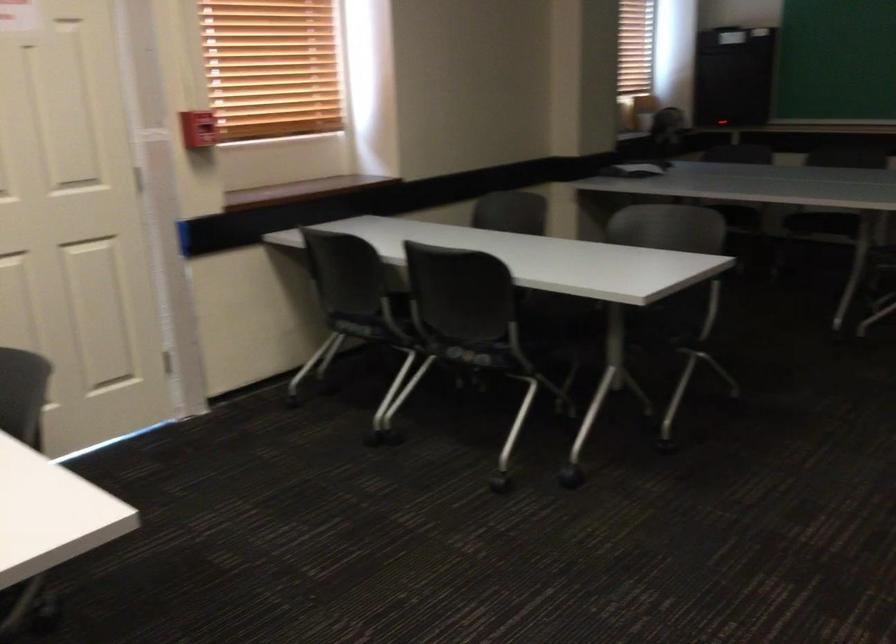
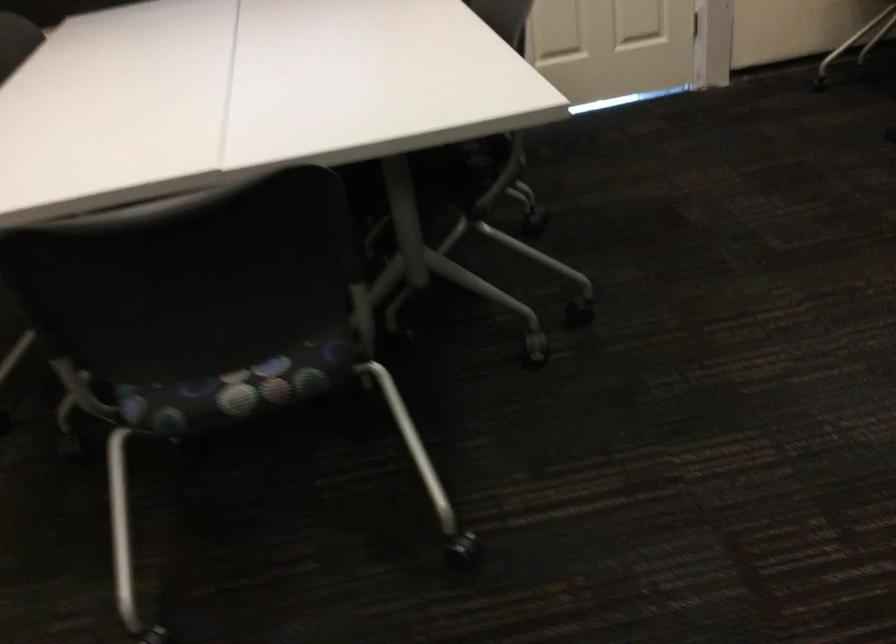
First-person continuous shooting, in which direction is the camera rotating?

The camera's rotation is toward left-down.